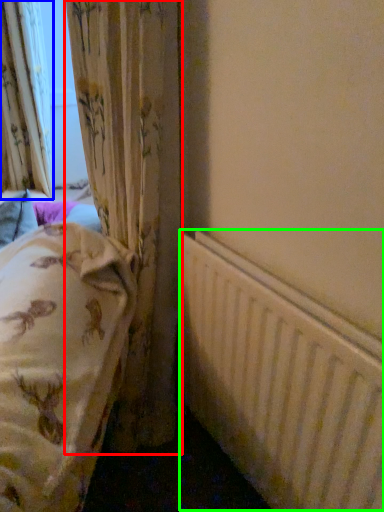
Question: Estimate the real-world distances between objects in this image. Which object is closer to curtain (highlighted by a red box), curtain (highlighted by a blue box) or radiator (highlighted by a green box)?

Choices:
 (A) curtain
 (B) radiator

Answer: (B)